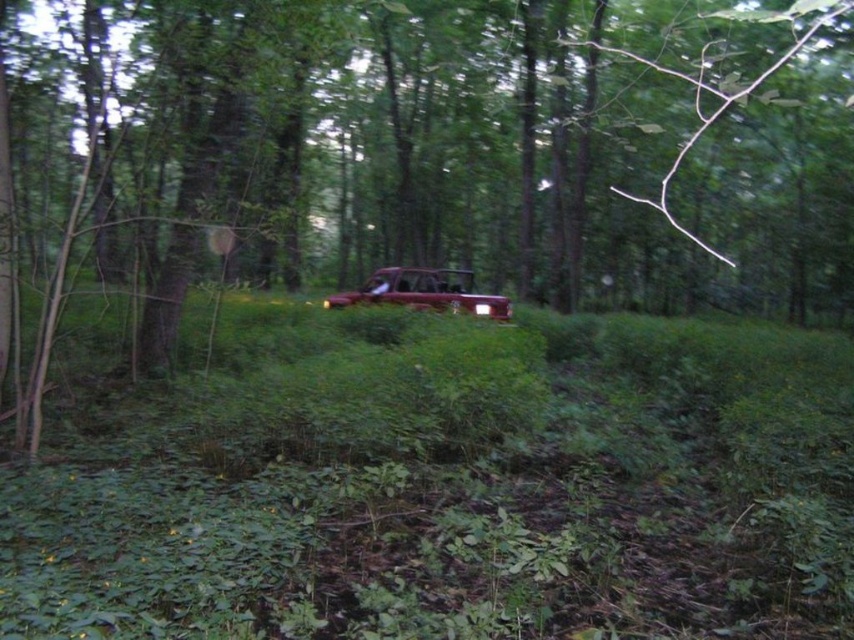
You are driving a shiny maroon car at center through a forest. You notice a green matte tree at center blocking your path. Can you safely pass around the tree without hitting it?

The green matte tree at center is closer to the viewer than the shiny maroon car at center, meaning the tree is in front of the car. Since the car is behind the tree, you cannot safely pass around it without moving forward first.